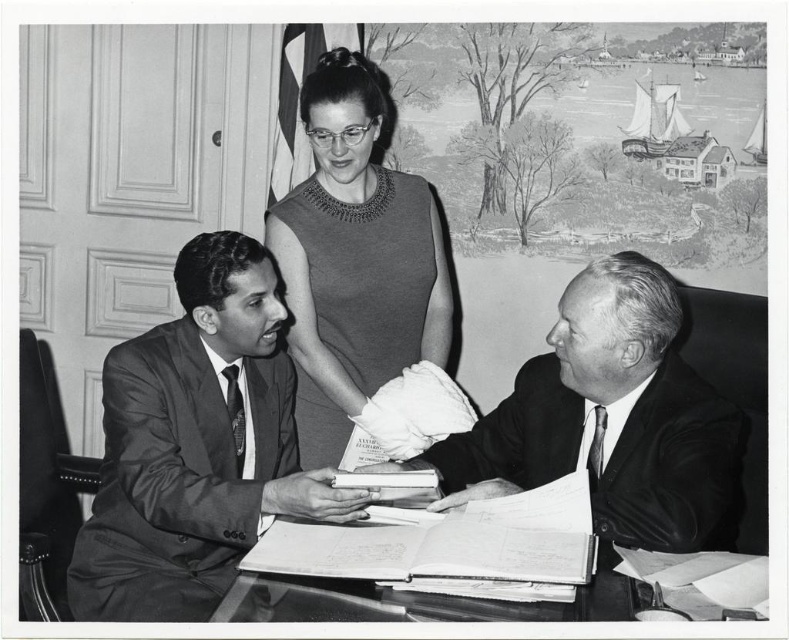
Does point (232, 346) come behind point (298, 260)?

No.

Looking at this image, can you confirm if smooth suit at left is positioned below smooth fabric dress at center?

Indeed, smooth suit at left is positioned under smooth fabric dress at center.

Find the location of a particular element. smooth suit at left is located at coordinates (196, 445).

Is point (174, 276) closer to camera compared to point (705, 576)?

No, (174, 276) is further to viewer.

Between smooth suit at left and smooth paper documents at center, which one has less height?

Standing shorter between the two is smooth paper documents at center.

This screenshot has width=789, height=640. In order to click on smooth suit at left in this screenshot , I will do `click(196, 445)`.

Is point (597, 451) in front of point (533, 588)?

No.

Between smooth black suit at center and smooth paper documents at center, which one has less height?

With less height is smooth paper documents at center.

Where is `smooth black suit at center`? smooth black suit at center is located at coordinates (611, 419).